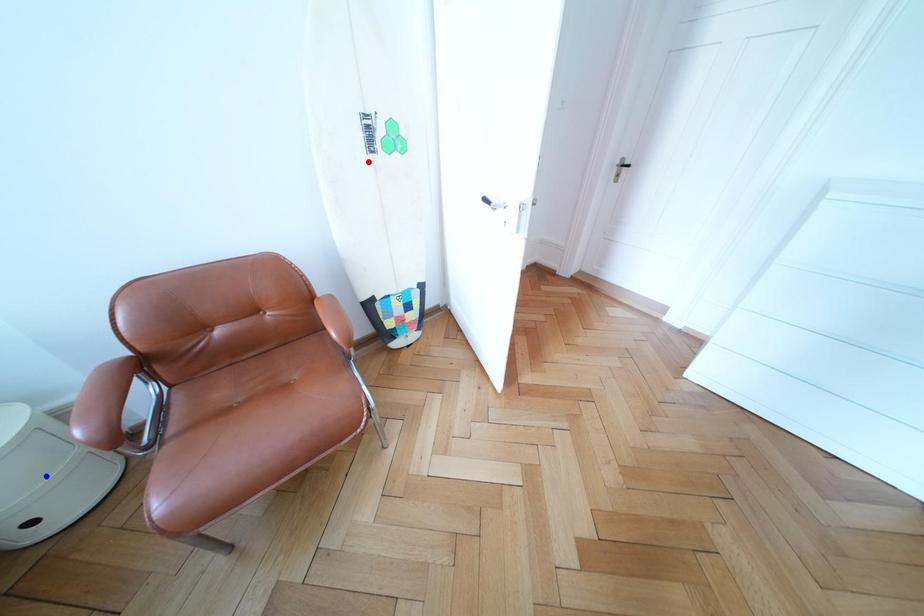
Question: Which of the two points in the image is closer to the camera?

Choices:
 (A) Blue point is closer.
 (B) Red point is closer.

Answer: (A)